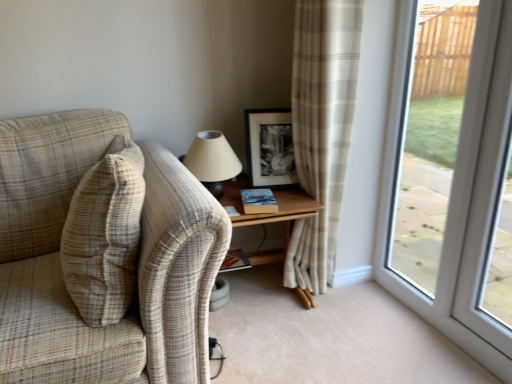
Find the location of a particular element. The image size is (512, 384). vacant area that is situated to the right of hardcover book at center, arranged as the second book when viewed from the back is located at coordinates (295, 200).